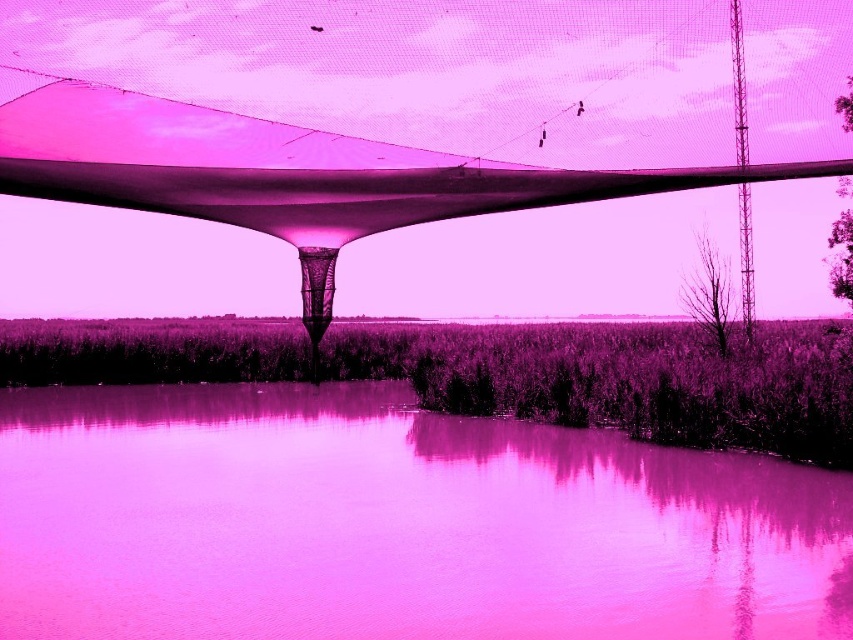
Is pink glossy water at lower center thinner than transparent fabric canopy at center?

Yes.

Can you confirm if pink glossy water at lower center is wider than transparent fabric canopy at center?

No, pink glossy water at lower center is not wider than transparent fabric canopy at center.

Who is more forward, (625, 534) or (461, 93)?

Point (625, 534) is more forward.

What are the coordinates of `pink glossy water at lower center` in the screenshot? It's located at (395, 524).